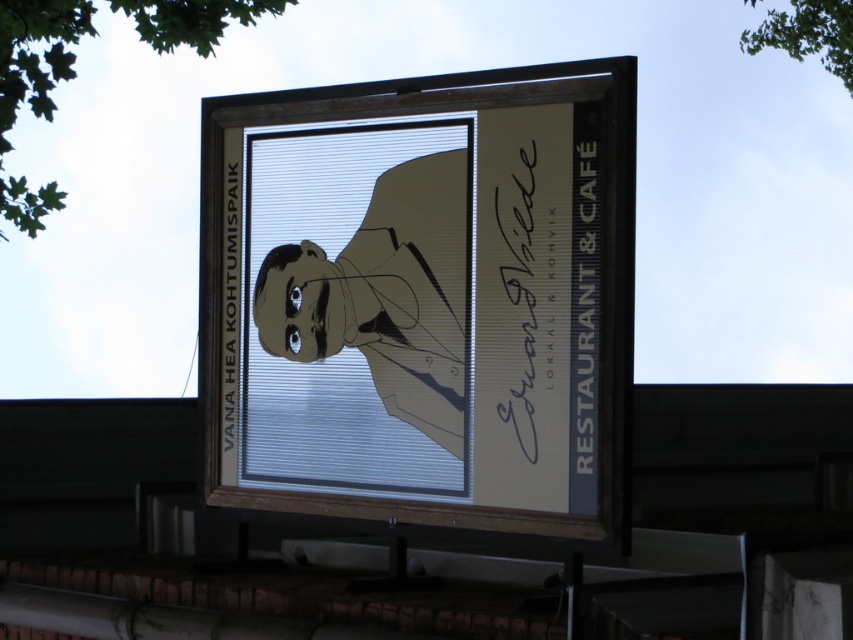
Question: Is matte beige signboard at center in front of black paper at left?

Choices:
 (A) no
 (B) yes

Answer: (B)

Question: Can you confirm if matte beige signboard at center is positioned below black paper at left?

Choices:
 (A) no
 (B) yes

Answer: (A)

Question: Which of the following is the farthest from the observer?

Choices:
 (A) black paper at right
 (B) matte beige signboard at center
 (C) black paper at left

Answer: (C)

Question: Which object is closer to the camera taking this photo?

Choices:
 (A) black paper at right
 (B) matte beige signboard at center
 (C) black paper at left

Answer: (B)

Question: Can you confirm if black paper at right is smaller than black paper at left?

Choices:
 (A) yes
 (B) no

Answer: (A)

Question: Which of the following is the farthest from the observer?

Choices:
 (A) matte beige signboard at center
 (B) black paper at left

Answer: (B)